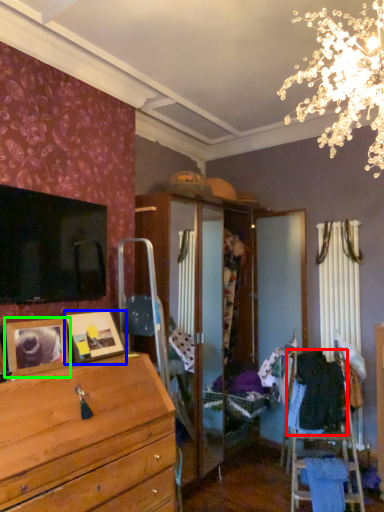
Question: Which object is the farthest from clothing (highlighted by a red box)? Choose among these: picture frame (highlighted by a blue box) or picture frame (highlighted by a green box).

Choices:
 (A) picture frame
 (B) picture frame

Answer: (B)